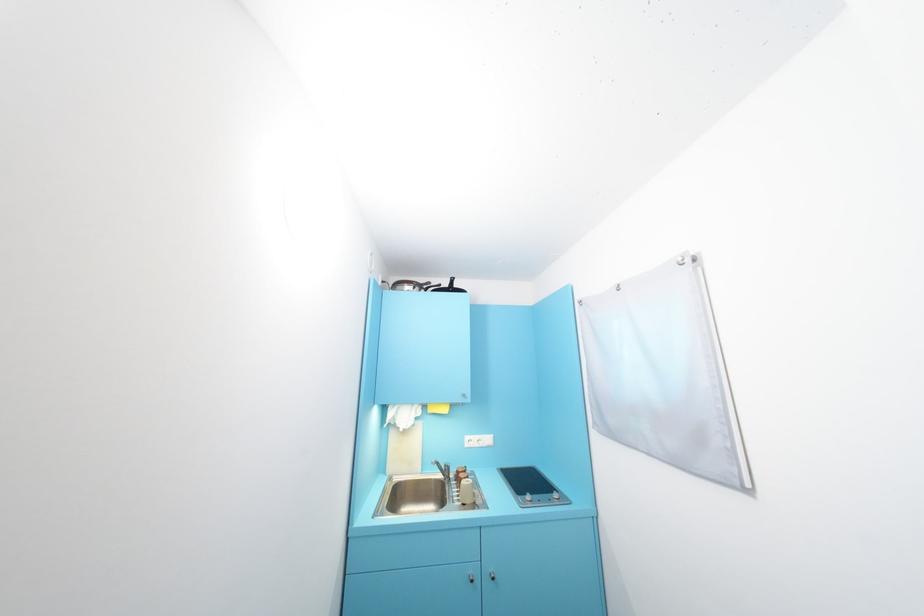
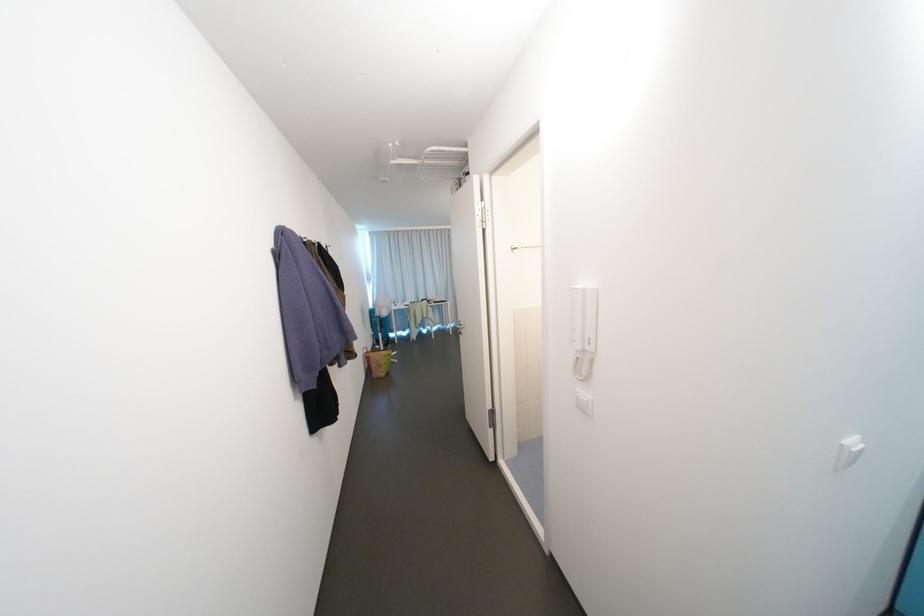
Question: Based on the continuous images, in which direction is the camera rotating? Reply with the corresponding letter.

Choices:
 (A) Left
 (B) Right
 (C) Up
 (D) Down

Answer: (A)